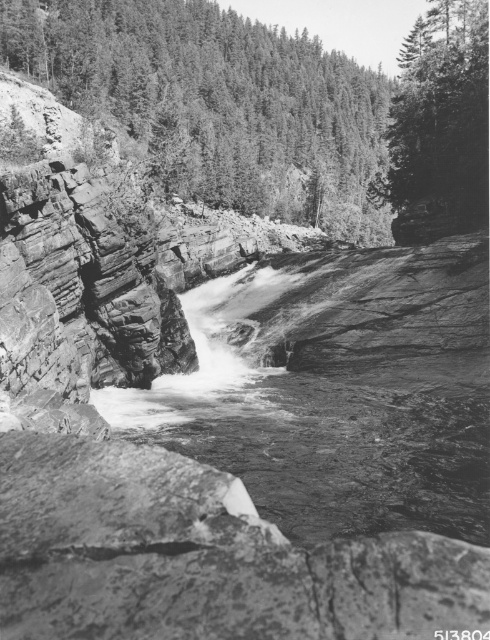
Between dark green textured tree at upper center and smooth green tree at upper right, which one appears on the left side from the viewer's perspective?

Positioned to the left is dark green textured tree at upper center.

Between dark green textured tree at upper center and smooth green tree at upper right, which one is positioned higher?

dark green textured tree at upper center is higher up.

Which is in front, point (165, 60) or point (443, 172)?

Point (443, 172)

Find the location of a particular element. dark green textured tree at upper center is located at coordinates (219, 104).

Image resolution: width=490 pixels, height=640 pixels. What do you see at coordinates (338, 388) in the screenshot?
I see `smooth rock water at center` at bounding box center [338, 388].

Does smooth rock water at center come behind dark green textured tree at upper center?

No, smooth rock water at center is in front of dark green textured tree at upper center.

Who is more distant from viewer, (323, 365) or (273, 93)?

The point (273, 93) is behind.

At what (x,y) coordinates should I click in order to perform the action: click on smooth rock water at center. Please return your answer as a coordinate pair (x, y). The width and height of the screenshot is (490, 640). Looking at the image, I should click on (338, 388).

Can you confirm if smooth rock water at center is taller than smooth green tree at upper right?

In fact, smooth rock water at center may be shorter than smooth green tree at upper right.

The height and width of the screenshot is (640, 490). I want to click on smooth rock water at center, so pos(338,388).

Does point (467, 308) lie behind point (392, 161)?

No.

Find the location of a particular element. Image resolution: width=490 pixels, height=640 pixels. smooth rock water at center is located at coordinates (338, 388).